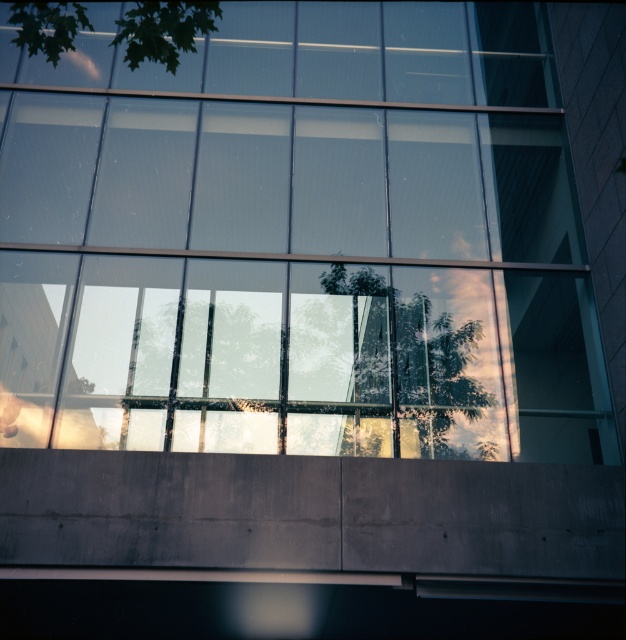
Can you confirm if transparent glass window at center is positioned below green leafy tree at upper left?

Correct, transparent glass window at center is located below green leafy tree at upper left.

The width and height of the screenshot is (626, 640). Find the location of `transparent glass window at center`. transparent glass window at center is located at coordinates (316, 236).

Who is more forward, (334, 419) or (188, 49)?

Point (188, 49) is in front.

Where is `transparent glass window at center`? The height and width of the screenshot is (640, 626). transparent glass window at center is located at coordinates (316, 236).